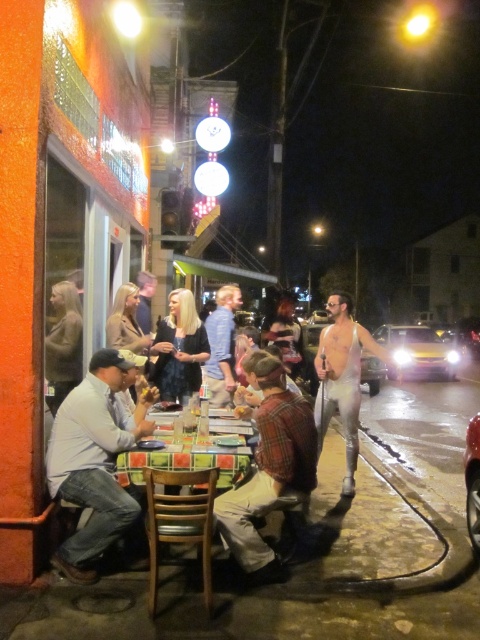
Question: Can you confirm if plaid fabric table at lower center is positioned above smooth white bread at lower center?

Choices:
 (A) yes
 (B) no

Answer: (B)

Question: Considering the real-world distances, which object is closest to the blue cotton shirt at center?

Choices:
 (A) plaid fabric table at center
 (B) light brown leather jacket at left

Answer: (B)

Question: Which of these objects is positioned closest to the smooth white bread at lower center?

Choices:
 (A) dark blue dress at center
 (B) silver metallic suit at right

Answer: (A)

Question: Is light blue shirt at lower left above plaid fabric table at center?

Choices:
 (A) yes
 (B) no

Answer: (B)

Question: Does plaid shirt at center come behind plaid fabric table at lower center?

Choices:
 (A) no
 (B) yes

Answer: (B)

Question: Which point appears closest to the camera in this image?

Choices:
 (A) (181, 339)
 (B) (219, 289)
 (C) (68, 442)

Answer: (C)